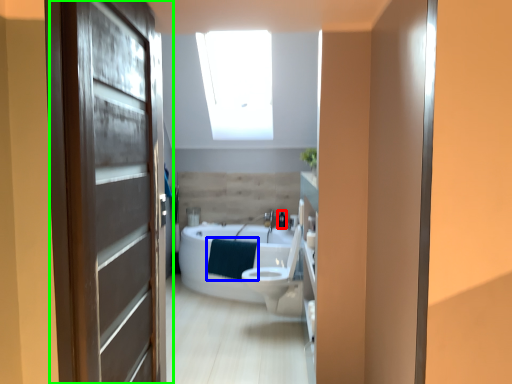
Question: Which object is the closest to the toiletry (highlighted by a red box)? Choose among these: blanket (highlighted by a blue box) or door (highlighted by a green box).

Choices:
 (A) blanket
 (B) door

Answer: (A)